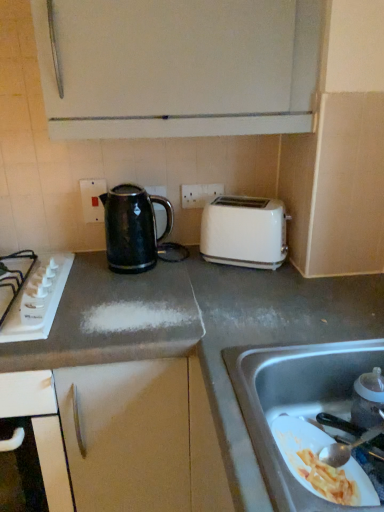
Locate an element on the screen. The width and height of the screenshot is (384, 512). free space in front of black glossy kettle at center is located at coordinates (131, 290).